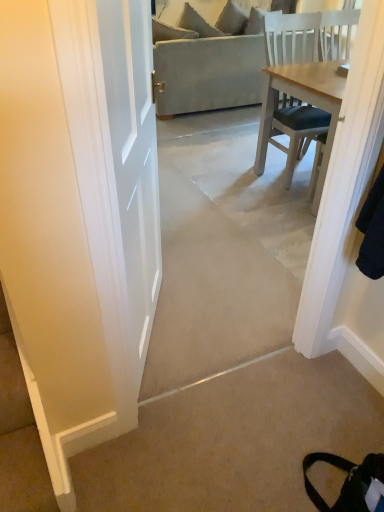
Question: Should I look upward or downward to see beige fabric couch at center?

Choices:
 (A) up
 (B) down

Answer: (A)

Question: Considering the relative sizes of beige fabric couch at center and beige carpet at lower right in the image provided, is beige fabric couch at center wider than beige carpet at lower right?

Choices:
 (A) no
 (B) yes

Answer: (B)

Question: Could you tell me if beige fabric couch at center is turned towards beige carpet at lower right?

Choices:
 (A) yes
 (B) no

Answer: (B)

Question: Can you confirm if beige fabric couch at center is thinner than beige carpet at lower right?

Choices:
 (A) no
 (B) yes

Answer: (A)

Question: Does beige fabric couch at center have a smaller size compared to beige carpet at lower right?

Choices:
 (A) no
 (B) yes

Answer: (A)

Question: Could beige carpet at lower right be considered to be inside beige fabric couch at center?

Choices:
 (A) yes
 (B) no

Answer: (B)

Question: From a real-world perspective, is beige fabric couch at center located beneath beige carpet at lower right?

Choices:
 (A) no
 (B) yes

Answer: (A)

Question: Could you tell me if beige carpet at lower right is turned towards beige fabric couch at center?

Choices:
 (A) no
 (B) yes

Answer: (A)

Question: Is beige carpet at lower right thinner than beige fabric couch at center?

Choices:
 (A) yes
 (B) no

Answer: (A)

Question: From a real-world perspective, is beige carpet at lower right under beige fabric couch at center?

Choices:
 (A) yes
 (B) no

Answer: (A)

Question: Is beige carpet at lower right taller than beige fabric couch at center?

Choices:
 (A) yes
 (B) no

Answer: (B)

Question: Considering the relative sizes of beige carpet at lower right and beige fabric couch at center in the image provided, is beige carpet at lower right bigger than beige fabric couch at center?

Choices:
 (A) no
 (B) yes

Answer: (A)

Question: Is the depth of beige carpet at lower right less than that of beige fabric couch at center?

Choices:
 (A) no
 (B) yes

Answer: (B)

Question: In terms of size, does beige carpet at lower right appear bigger or smaller than beige fabric couch at center?

Choices:
 (A) small
 (B) big

Answer: (A)